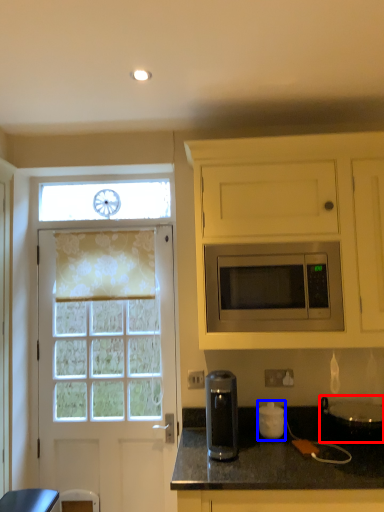
Question: Which point is closer to the camera, appliance (highlighted by a red box) or appliance (highlighted by a blue box)?

Choices:
 (A) appliance
 (B) appliance

Answer: (A)